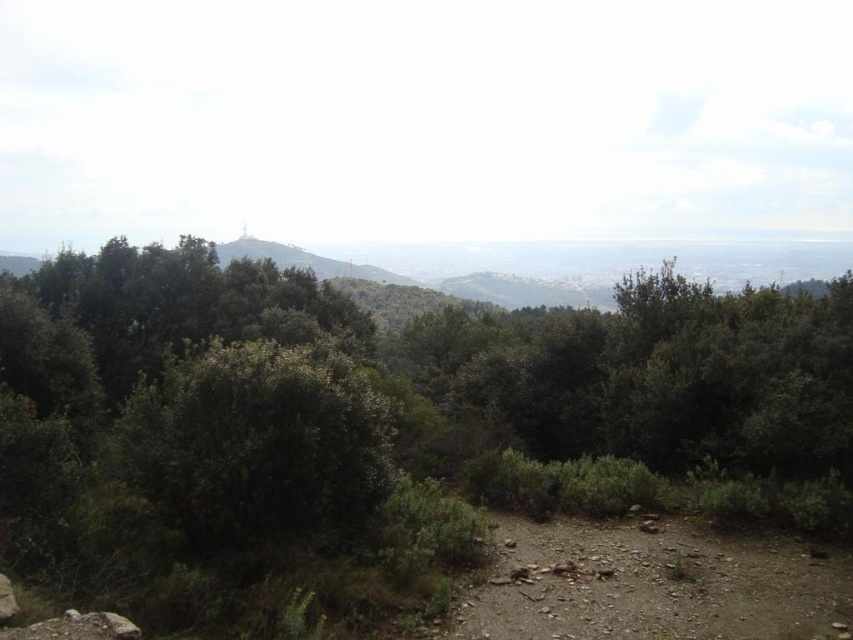
You are hiking and want to reach the brown rocky dirt track at lower right. From your current position, which direction should you move relative to the green leafy forest at center?

To reach the brown rocky dirt track at lower right, you should move away from the green leafy forest at center since it is in front of the dirt track, meaning the track is behind the forest from your current position.